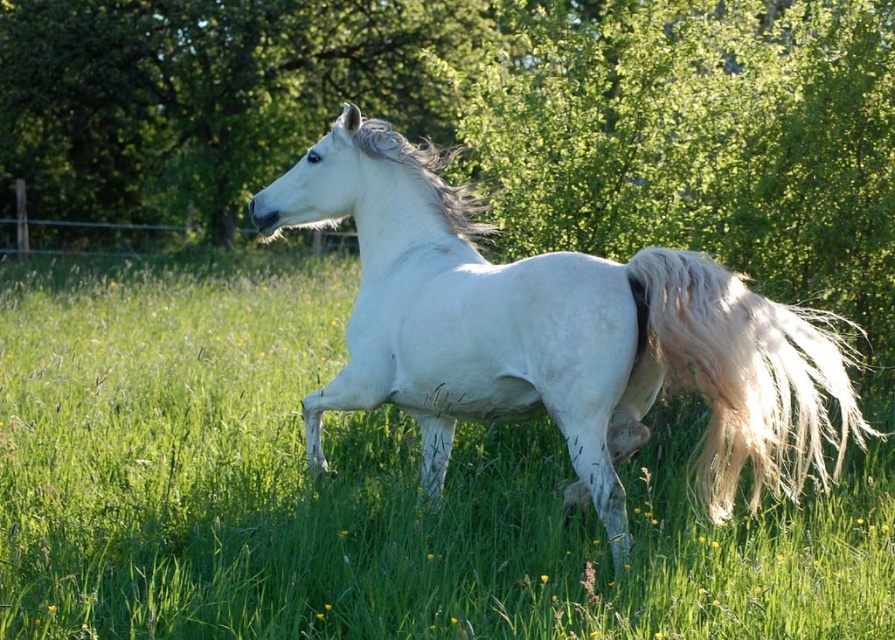
Question: Considering the real-world distances, which object is farthest from the green leafy tree at center?

Choices:
 (A) white glossy horse at center
 (B) white silky tail at right

Answer: (B)

Question: Which of the following is the closest to the observer?

Choices:
 (A) green grass at center
 (B) white glossy horse at center
 (C) green leafy tree at center
 (D) white silky tail at right

Answer: (B)

Question: Which object appears farthest from the camera in this image?

Choices:
 (A) white silky tail at right
 (B) white glossy horse at center

Answer: (A)

Question: Does green leafy tree at center have a greater width compared to white glossy horse at center?

Choices:
 (A) yes
 (B) no

Answer: (A)

Question: Can you confirm if green grass at center is thinner than white glossy horse at center?

Choices:
 (A) no
 (B) yes

Answer: (B)

Question: Is white glossy horse at center closer to the viewer compared to white silky tail at right?

Choices:
 (A) no
 (B) yes

Answer: (B)